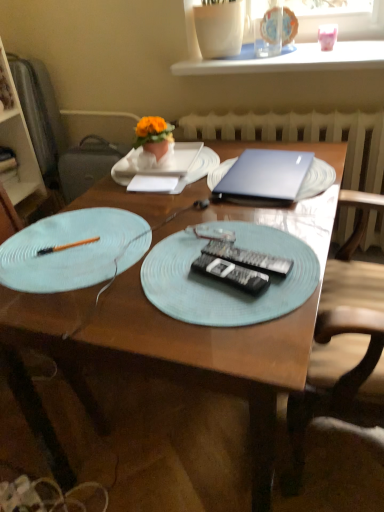
In order to click on free space between black plastic remote control at center, the second remote control in the top-to-bottom sequence, and light blue textured plate at left, which is counted as the 2th plate, starting from the back in this screenshot , I will do `click(171, 267)`.